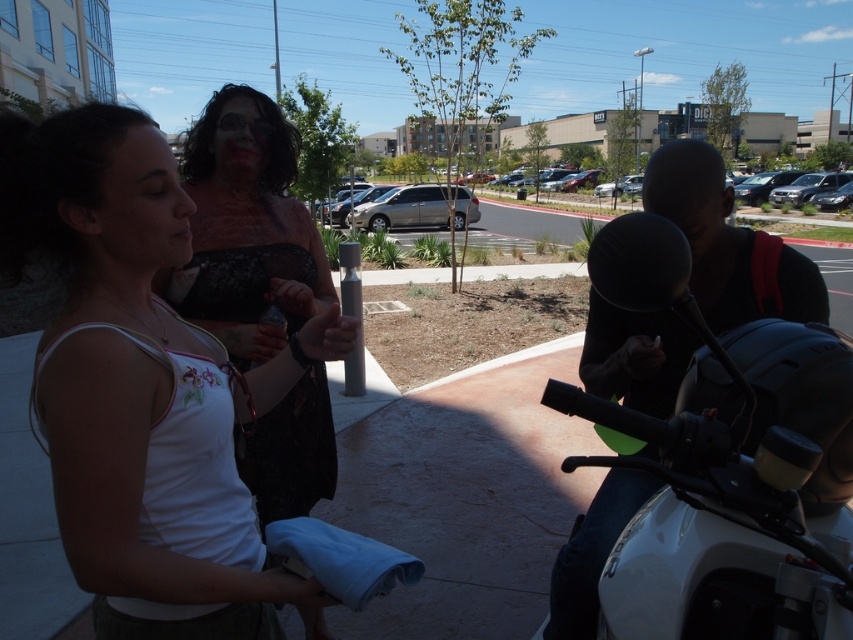
Based on the scene description, where exactly is the white fabric tank top at center located in the image?

The white fabric tank top at center is located at point 0.602 on the horizontal axis and 0.166 on the vertical axis.

You are a delivery person trying to deliver a package to the white fabric tank top at center and the white glossy motorcycle at right. Which one requires a smaller delivery area?

The white fabric tank top at center requires a smaller delivery area because it occupies less space than the white glossy motorcycle at right.